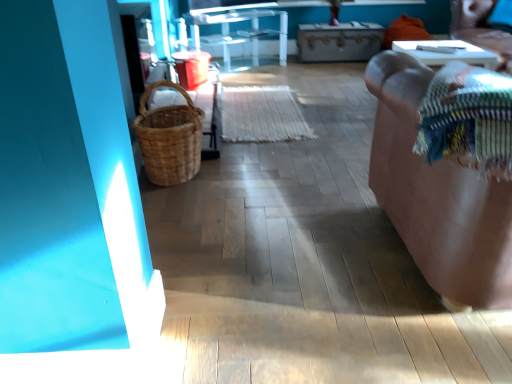
Question: Considering the relative positions of brown woven basket at upper right and wooden drawer at center in the image provided, is brown woven basket at upper right behind wooden drawer at center?

Choices:
 (A) yes
 (B) no

Answer: (B)

Question: Could you tell me if brown woven basket at upper right is facing wooden drawer at center?

Choices:
 (A) yes
 (B) no

Answer: (A)

Question: From a real-world perspective, is brown woven basket at upper right beneath wooden drawer at center?

Choices:
 (A) yes
 (B) no

Answer: (B)

Question: Considering the relative sizes of brown woven basket at upper right and wooden drawer at center in the image provided, is brown woven basket at upper right bigger than wooden drawer at center?

Choices:
 (A) yes
 (B) no

Answer: (B)

Question: Is brown woven basket at upper right to the left of wooden drawer at center from the viewer's perspective?

Choices:
 (A) yes
 (B) no

Answer: (B)

Question: Based on their sizes in the image, would you say wooden drawer at center is bigger or smaller than multicolored woven blanket at right?

Choices:
 (A) small
 (B) big

Answer: (B)

Question: From a real-world perspective, is wooden drawer at center physically located above or below multicolored woven blanket at right?

Choices:
 (A) above
 (B) below

Answer: (B)

Question: In the image, is wooden drawer at center positioned in front of or behind multicolored woven blanket at right?

Choices:
 (A) front
 (B) behind

Answer: (B)

Question: From the image's perspective, relative to multicolored woven blanket at right, is wooden drawer at center above or below?

Choices:
 (A) below
 (B) above

Answer: (B)

Question: Looking at their shapes, would you say transparent glass table at center, which is the first furniture from back to front, is wider or thinner than brown leather couch at right, placed as the first furniture when sorted from right to left?

Choices:
 (A) wide
 (B) thin

Answer: (B)

Question: In terms of size, does transparent glass table at center, which is the 2th furniture in right-to-left order, appear bigger or smaller than brown leather couch at right, the 1th furniture in the front-to-back sequence?

Choices:
 (A) big
 (B) small

Answer: (B)

Question: From a real-world perspective, relative to brown leather couch at right, which ranks as the second furniture in left-to-right order, is transparent glass table at center, which is the 2th furniture in right-to-left order, vertically above or below?

Choices:
 (A) below
 (B) above

Answer: (A)

Question: Is transparent glass table at center, which is the 2th furniture in right-to-left order, taller or shorter than brown leather couch at right, which ranks as the second furniture in left-to-right order?

Choices:
 (A) short
 (B) tall

Answer: (A)

Question: From a real-world perspective, is multicolored woven blanket at right physically located above or below wooden drawer at center?

Choices:
 (A) below
 (B) above

Answer: (B)

Question: Considering the positions of point (473, 94) and point (302, 59), is point (473, 94) closer or farther from the camera than point (302, 59)?

Choices:
 (A) farther
 (B) closer

Answer: (B)